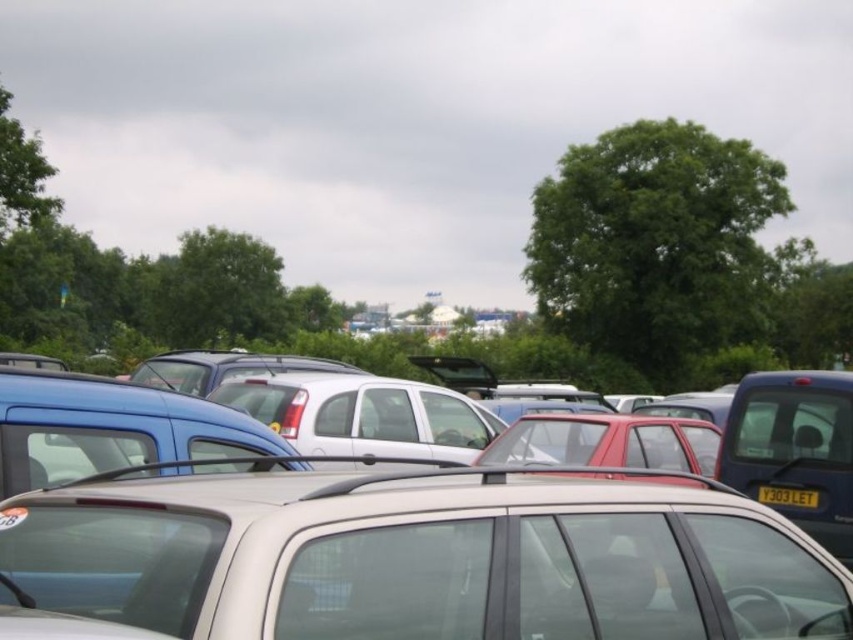
Question: Which point is closer to the camera?

Choices:
 (A) yellow matte license plate at center
 (B) satin silver car at center

Answer: (B)

Question: Does satin silver car at center appear on the right side of yellow matte license plate at center?

Choices:
 (A) yes
 (B) no

Answer: (B)

Question: Which point is farther to the camera?

Choices:
 (A) satin silver car at center
 (B) yellow matte license plate at center

Answer: (B)

Question: Does satin silver car at center come behind yellow matte license plate at center?

Choices:
 (A) yes
 (B) no

Answer: (B)

Question: In this image, where is satin silver car at center located relative to yellow matte license plate at center?

Choices:
 (A) above
 (B) below

Answer: (A)